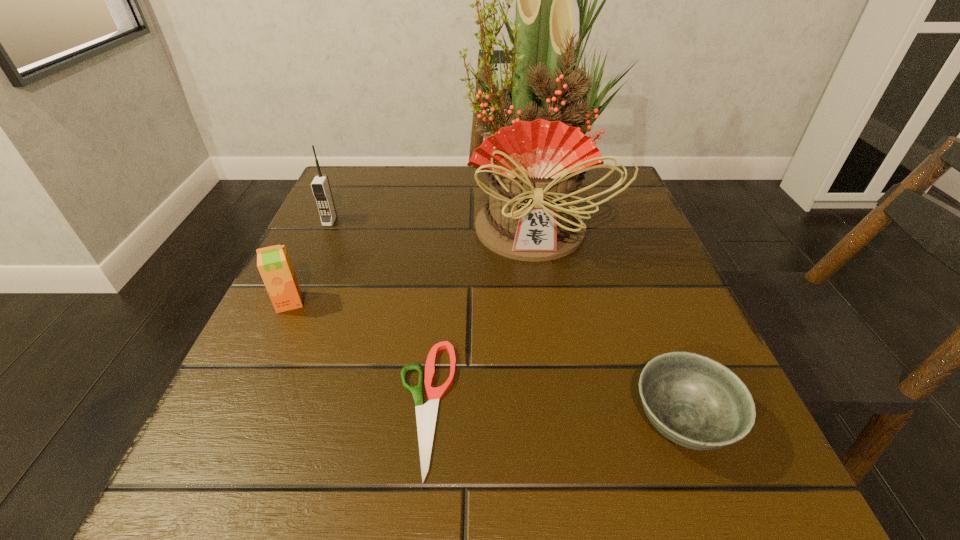
At what (x,y) coordinates should I click in order to perform the action: click on the tallest object. Please return your answer as a coordinate pair (x, y). Image resolution: width=960 pixels, height=540 pixels. Looking at the image, I should click on (535, 162).

Where is `cellular telephone`? This screenshot has height=540, width=960. cellular telephone is located at coordinates point(320,185).

Find the location of a particular element. the third farthest object is located at coordinates (273, 262).

You are a GUI agent. You are given a task and a screenshot of the screen. Output one action in this format:
    pyautogui.click(x=<x>, y=<y>)
    Task: Click on the third tallest object
    Image resolution: width=960 pixels, height=540 pixels.
    Given the screenshot: What is the action you would take?
    pyautogui.click(x=273, y=262)

Locate an element on the screen. The height and width of the screenshot is (540, 960). bowl is located at coordinates (694, 401).

Where is `the shortest object`? the shortest object is located at coordinates (426, 415).

Identify the location of free space located 0.290m in front of the tallest object with the fan visible. (562, 408).

This screenshot has height=540, width=960. I want to click on free location located 0.230m on the front-facing side of the fourth shortest object, so click(x=291, y=306).

At what (x,y) coordinates should I click in order to perform the action: click on free space located on the back of the third shortest object. Please return your answer as a coordinate pair (x, y). Looking at the image, I should click on (333, 207).

Where is `vacant region located on the back of the fourth tallest object`? The height and width of the screenshot is (540, 960). vacant region located on the back of the fourth tallest object is located at coordinates (608, 229).